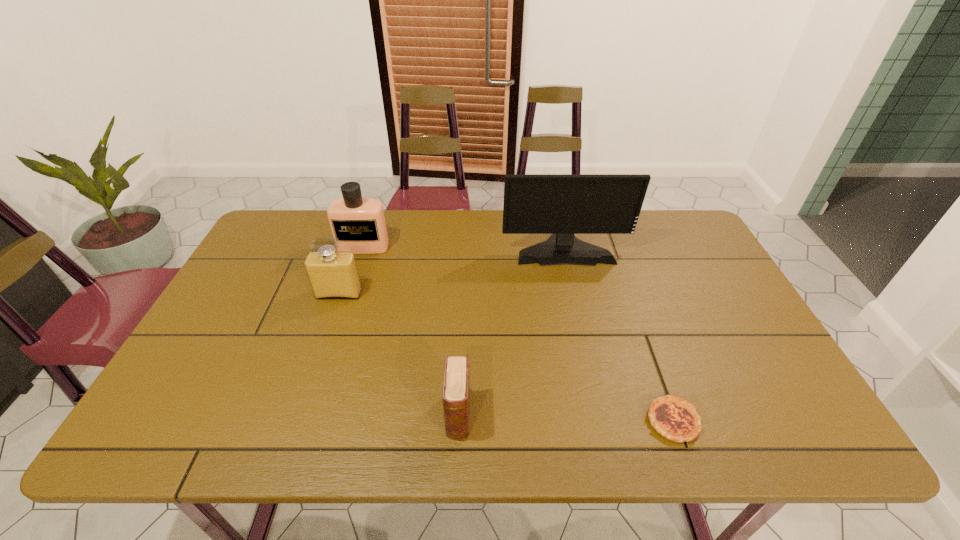
The height and width of the screenshot is (540, 960). Identify the location of vacant space that is in between the shorter perfume and the shortest object. (506, 357).

Locate an element on the screen. The image size is (960, 540). free space that is in between the diary and the tallest object is located at coordinates (512, 332).

What are the coordinates of `free space between the shortest object and the tallest object` in the screenshot? It's located at (619, 335).

Find the location of a particular element. This screenshot has height=540, width=960. vacant space that's between the second shortest object and the nearer perfume is located at coordinates (398, 355).

Find the location of a particular element. This screenshot has width=960, height=540. vacant area between the diary and the tallest object is located at coordinates (512, 332).

Where is `vacant space in between the farther perfume and the monitor`? vacant space in between the farther perfume and the monitor is located at coordinates (464, 248).

Where is `free point between the nearer perfume and the shortest object`? free point between the nearer perfume and the shortest object is located at coordinates (506, 357).

Locate an element on the screen. The width and height of the screenshot is (960, 540). unoccupied area between the third object from left to right and the farther perfume is located at coordinates (411, 331).

The width and height of the screenshot is (960, 540). In order to click on vacant point located between the shorter perfume and the shortest object in this screenshot , I will do `click(506, 357)`.

Locate an element on the screen. The image size is (960, 540). vacant area that lies between the nearer perfume and the quiche is located at coordinates (506, 357).